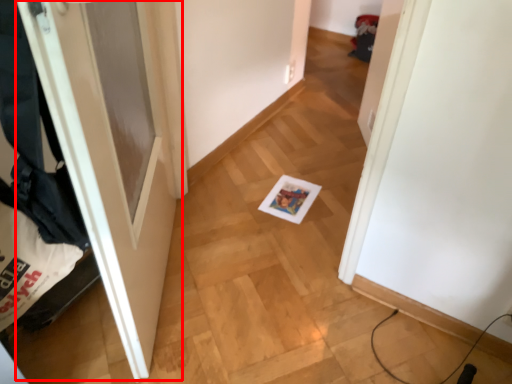
Question: From the image's perspective, considering the relative positions of door (annotated by the red box) and laundry in the image provided, where is door (annotated by the red box) located with respect to the staircase?

Choices:
 (A) above
 (B) below

Answer: (A)